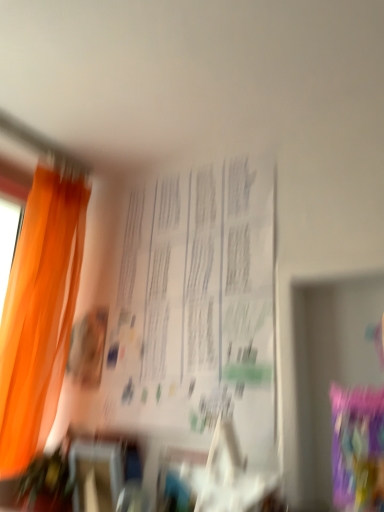
Question: Is white paper at center beside orange fabric curtain at left?

Choices:
 (A) yes
 (B) no

Answer: (B)

Question: Is white paper at center oriented towards orange fabric curtain at left?

Choices:
 (A) no
 (B) yes

Answer: (A)

Question: Considering the relative positions of white paper at center and orange fabric curtain at left in the image provided, is white paper at center behind orange fabric curtain at left?

Choices:
 (A) yes
 (B) no

Answer: (B)

Question: Are white paper at center and orange fabric curtain at left far apart?

Choices:
 (A) yes
 (B) no

Answer: (B)

Question: Does white paper at center lie in front of orange fabric curtain at left?

Choices:
 (A) no
 (B) yes

Answer: (B)

Question: From the image's perspective, is white paper at center above orange fabric curtain at left?

Choices:
 (A) no
 (B) yes

Answer: (B)

Question: Considering the relative positions of orange fabric curtain at left and white paper at center in the image provided, is orange fabric curtain at left to the left of white paper at center from the viewer's perspective?

Choices:
 (A) no
 (B) yes

Answer: (B)

Question: Is orange fabric curtain at left located outside white paper at center?

Choices:
 (A) no
 (B) yes

Answer: (B)

Question: Does orange fabric curtain at left have a lesser height compared to white paper at center?

Choices:
 (A) no
 (B) yes

Answer: (A)

Question: Is orange fabric curtain at left positioned behind white paper at center?

Choices:
 (A) no
 (B) yes

Answer: (B)

Question: From a real-world perspective, is orange fabric curtain at left on top of white paper at center?

Choices:
 (A) yes
 (B) no

Answer: (B)

Question: Is orange fabric curtain at left aimed at white paper at center?

Choices:
 (A) yes
 (B) no

Answer: (A)

Question: From the image's perspective, is orange fabric curtain at left located above or below white paper at center?

Choices:
 (A) below
 (B) above

Answer: (A)